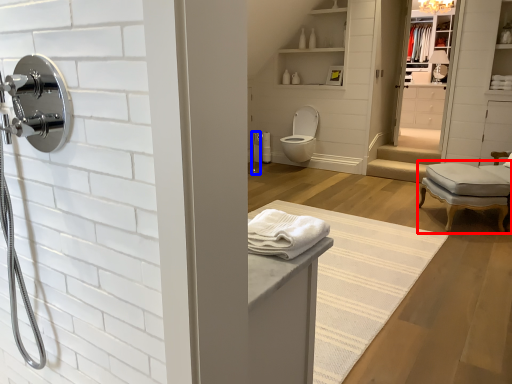
Question: Which of the following is the farthest to the observer, chair (highlighted by a red box) or shower (highlighted by a blue box)?

Choices:
 (A) chair
 (B) shower

Answer: (B)